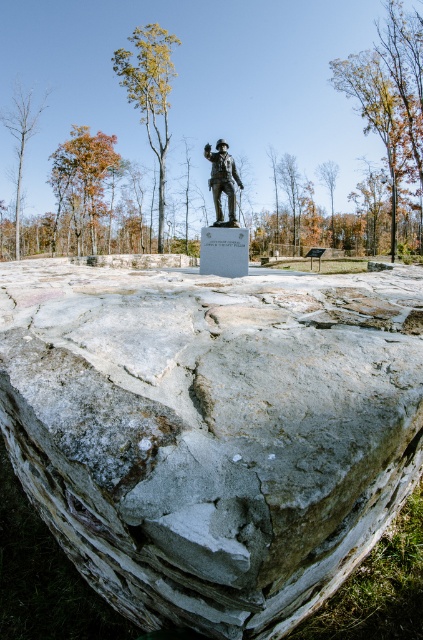
Is gray stone boulder at center closer to the viewer compared to green leafy tree at upper center?

Yes, gray stone boulder at center is closer to the viewer.

Find the location of a particular element. The width and height of the screenshot is (423, 640). gray stone boulder at center is located at coordinates (211, 432).

Find the location of a particular element. gray stone boulder at center is located at coordinates (211, 432).

Can you confirm if brown leafy tree at upper right is thinner than bare wood tree at left?

Incorrect, brown leafy tree at upper right's width is not less than bare wood tree at left's.

Is point (386, 54) behind point (29, 122)?

No, (386, 54) is in front of (29, 122).

The image size is (423, 640). Identify the location of brown leafy tree at upper right. (390, 93).

Locate an element on the screen. brown leafy tree at upper right is located at coordinates (390, 93).

What do you see at coordinates (390, 93) in the screenshot? I see `brown leafy tree at upper right` at bounding box center [390, 93].

Can you confirm if brown leafy tree at upper right is positioned to the right of brown wood tree at center?

Correct, you'll find brown leafy tree at upper right to the right of brown wood tree at center.

Is point (420, 51) positioned in front of point (326, 177)?

Yes, it is in front of point (326, 177).

Locate an element on the screen. brown leafy tree at upper right is located at coordinates (390, 93).